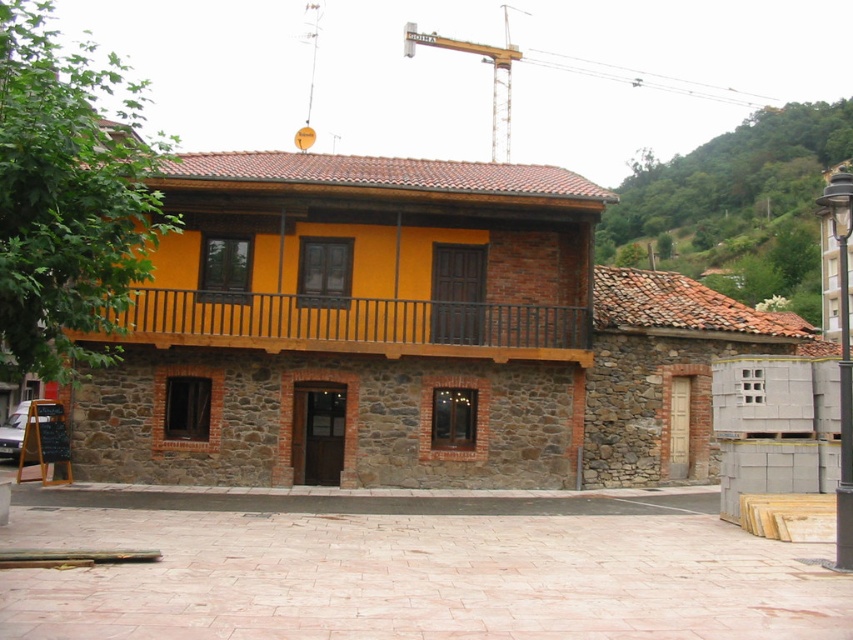
Question: Which of the following is the farthest from the observer?

Choices:
 (A) wooden at upper center
 (B) green leafy hillside at upper right
 (C) metallic yellow crane at upper center

Answer: (B)

Question: Which of the following is the farthest from the observer?

Choices:
 (A) metallic yellow crane at upper center
 (B) green leafy hillside at upper right
 (C) wooden at upper center

Answer: (B)

Question: Can you confirm if green leafy hillside at upper right is bigger than wooden at upper center?

Choices:
 (A) yes
 (B) no

Answer: (A)

Question: Based on their relative distances, which object is nearer to the green leafy hillside at upper right?

Choices:
 (A) wooden at upper center
 (B) metallic yellow crane at upper center

Answer: (B)

Question: Does green leafy hillside at upper right appear on the left side of metallic yellow crane at upper center?

Choices:
 (A) yes
 (B) no

Answer: (B)

Question: Can you confirm if green leafy hillside at upper right is positioned to the right of metallic yellow crane at upper center?

Choices:
 (A) no
 (B) yes

Answer: (B)